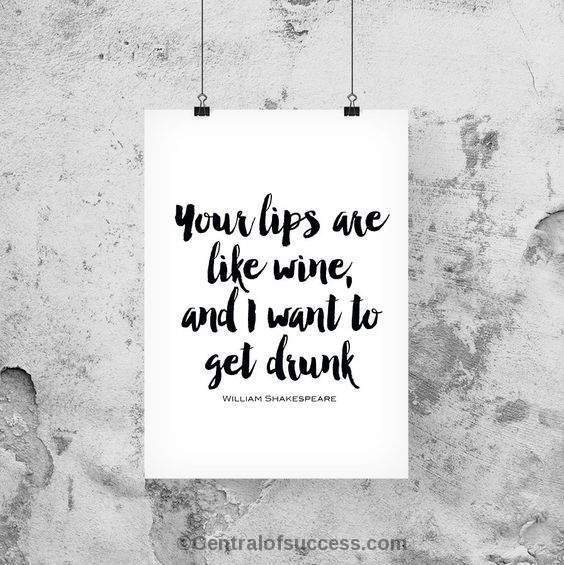
This screenshot has height=565, width=564. I want to click on wall, so click(443, 269), click(334, 511), click(90, 153), click(85, 247), click(88, 331), click(68, 486), click(290, 50).